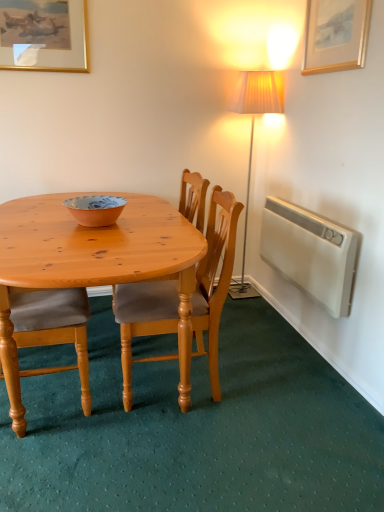
Where is `vacant area in front of light brown wood chair at center, the 2th chair positioned from the left`? vacant area in front of light brown wood chair at center, the 2th chair positioned from the left is located at coordinates (178, 450).